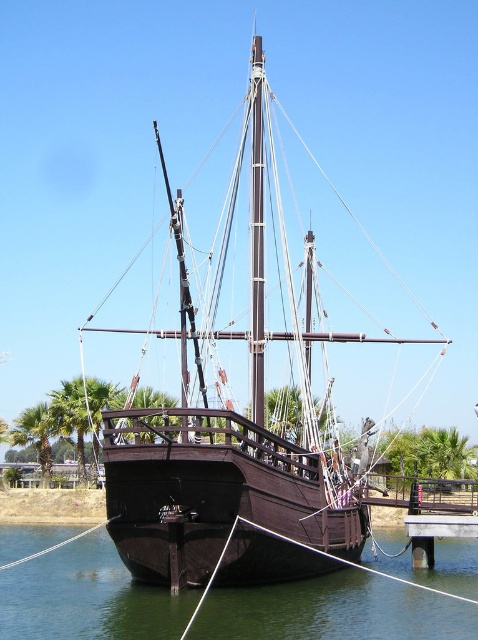
Question: Is brown wooden sailboat at center bigger than green water at lower center?

Choices:
 (A) no
 (B) yes

Answer: (B)

Question: Which object appears farthest from the camera in this image?

Choices:
 (A) green water at lower center
 (B) brown wooden sailboat at center

Answer: (B)

Question: Is brown wooden sailboat at center further to camera compared to green water at lower center?

Choices:
 (A) no
 (B) yes

Answer: (B)

Question: Which of the following is the closest to the observer?

Choices:
 (A) (262, 209)
 (B) (379, 561)

Answer: (A)

Question: Does brown wooden sailboat at center come in front of green water at lower center?

Choices:
 (A) no
 (B) yes

Answer: (A)

Question: Which point is closer to the camera taking this photo?

Choices:
 (A) (76, 556)
 (B) (316, 429)

Answer: (B)